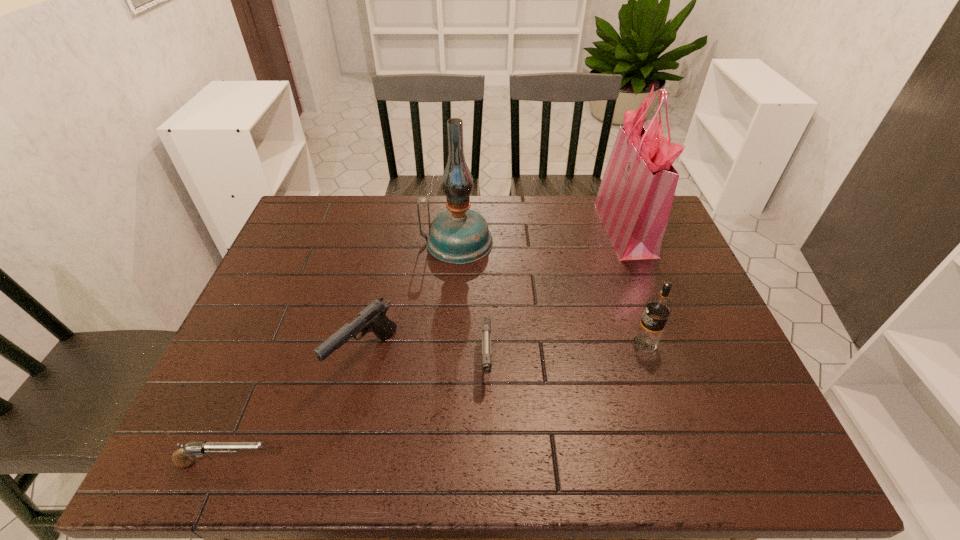
You are a GUI agent. You are given a task and a screenshot of the screen. Output one action in this format:
    pyautogui.click(x=<x>, y=<y>)
    Task: Click on the object situated at the left edge
    This screenshot has width=960, height=540.
    Given the screenshot: What is the action you would take?
    pyautogui.click(x=181, y=458)

You are a GUI agent. You are given a task and a screenshot of the screen. Output one action in this format:
    pyautogui.click(x=<x>, y=<y>)
    Task: Click on the object situated at the right edge
    The image size is (960, 540).
    Given the screenshot: What is the action you would take?
    pyautogui.click(x=634, y=201)

I want to click on object located at the near left corner, so click(x=181, y=458).

This screenshot has width=960, height=540. In order to click on object that is at the far right corner in this screenshot , I will do `click(634, 201)`.

Find the location of a particular element. vacant space at the far edge of the desktop is located at coordinates (379, 204).

This screenshot has width=960, height=540. I want to click on vacant space at the near edge, so click(x=520, y=455).

Where is `vacant space at the left edge`? Image resolution: width=960 pixels, height=540 pixels. vacant space at the left edge is located at coordinates (229, 401).

This screenshot has width=960, height=540. In the image, there is a desktop. In order to click on vacant space at the far left corner in this screenshot , I will do `click(340, 211)`.

The image size is (960, 540). In the image, there is a desktop. Find the location of `vacant space at the near left corner`. vacant space at the near left corner is located at coordinates click(228, 463).

Locate an element on the screen. vacant area that lies between the oil lamp and the tallest gun is located at coordinates (411, 299).